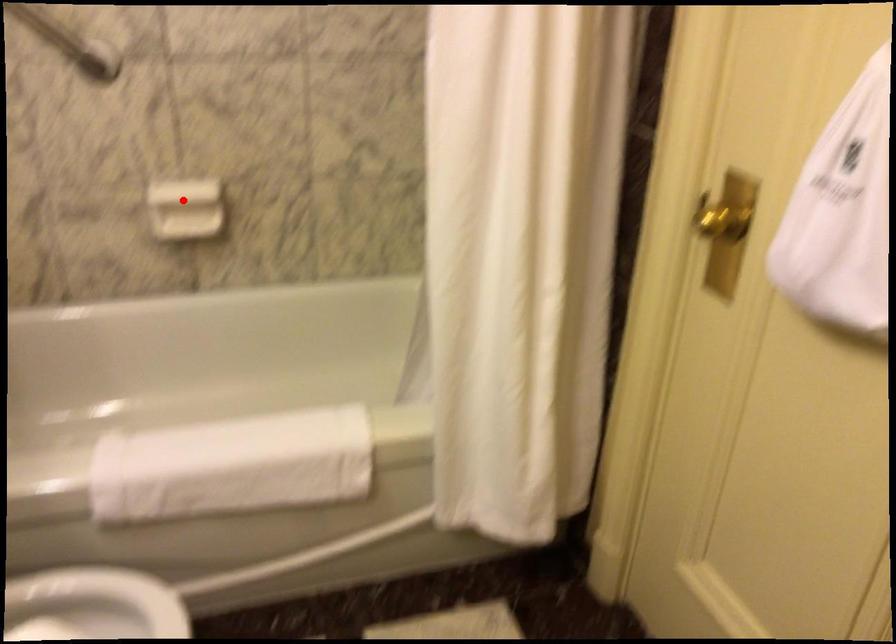
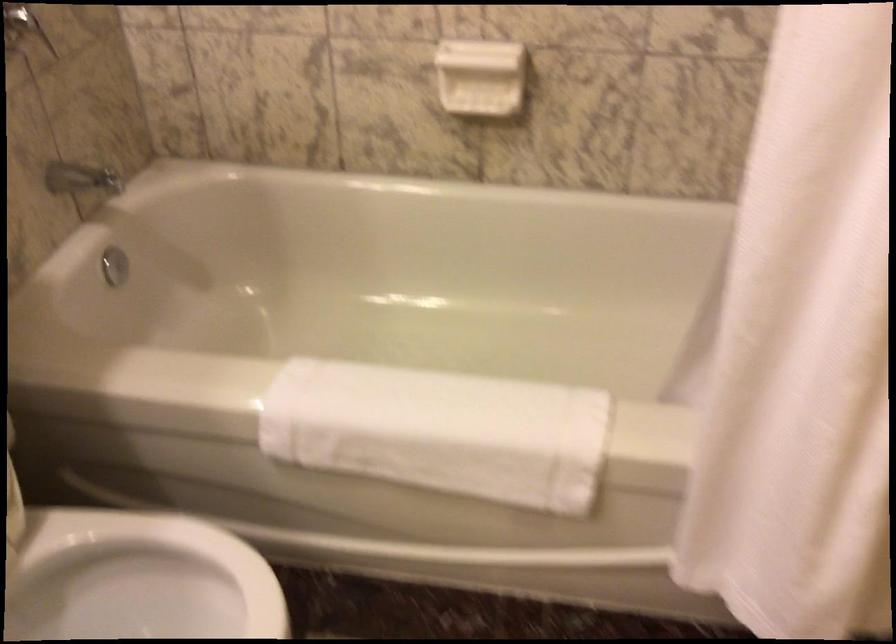
Find the pixel in the second image that matches the highlighted location in the first image.

(480, 77)